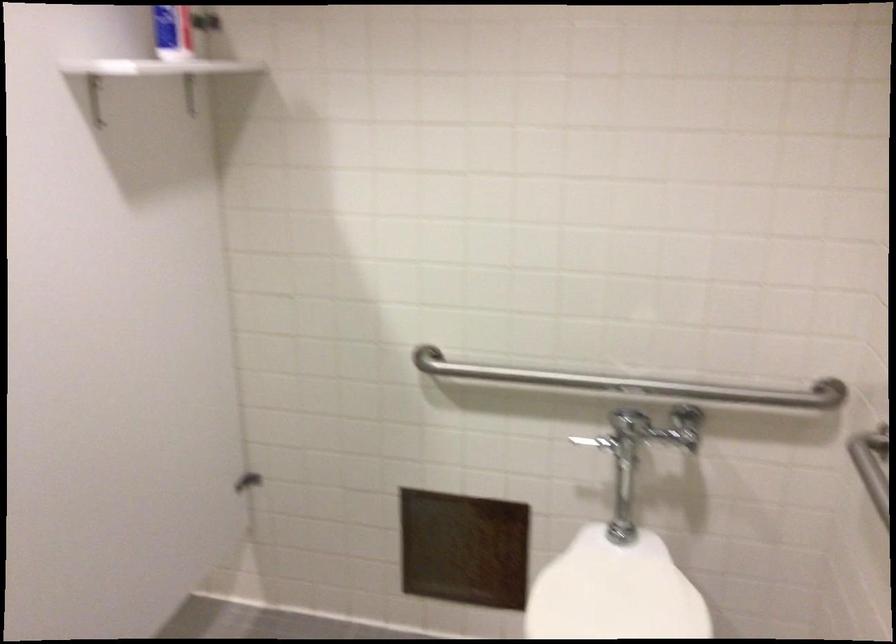
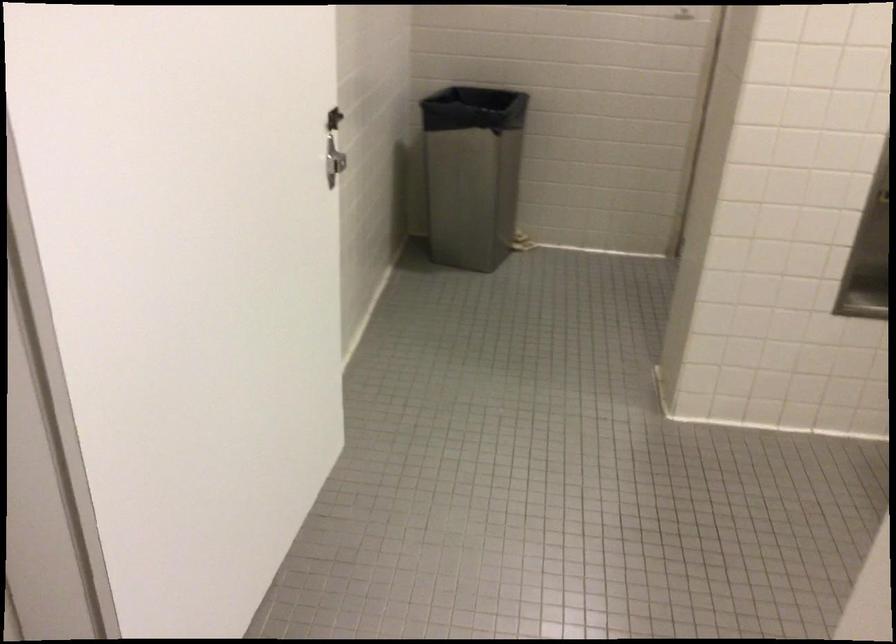
First-person continuous shooting, in which direction is the camera rotating?

The rotation direction of the camera is left-down.